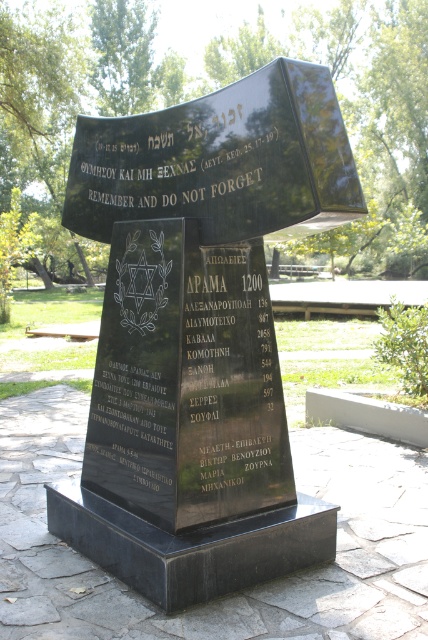
You are standing at the entrance of the park and want to locate the black polished stone monument at center. According to the coordinates given, where should you look relative to your current position?

The black polished stone monument at center is located at coordinates point (199, 333), so you should look slightly to the right and forward from your current position at the entrance.

In the scene shown: You are standing in front of the memorial and want to touch both the black polished stone at center and the black stone plaque at center. Which one can you reach first without moving your feet?

The black polished stone at center is closer to you than the black stone plaque at center, so you can reach it first without moving your feet.